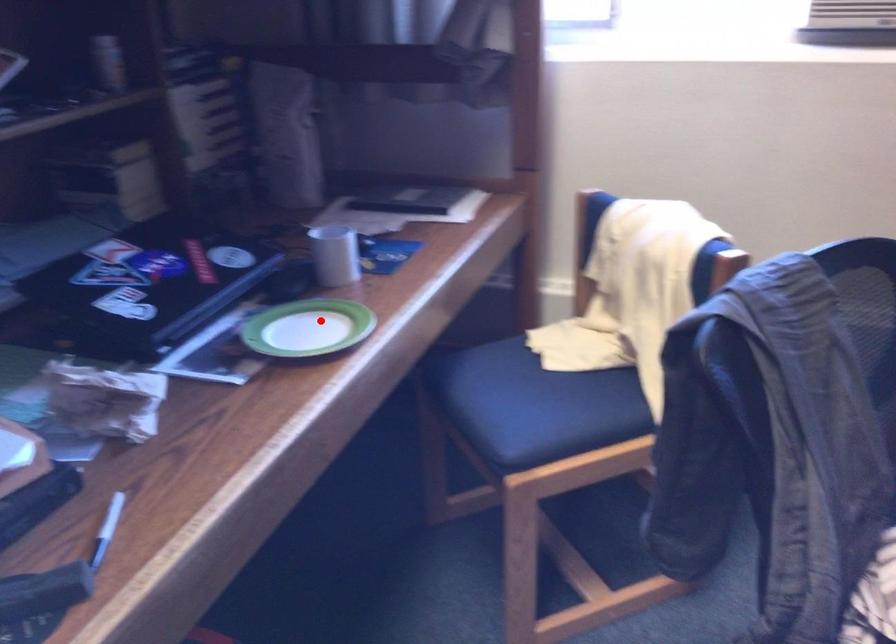
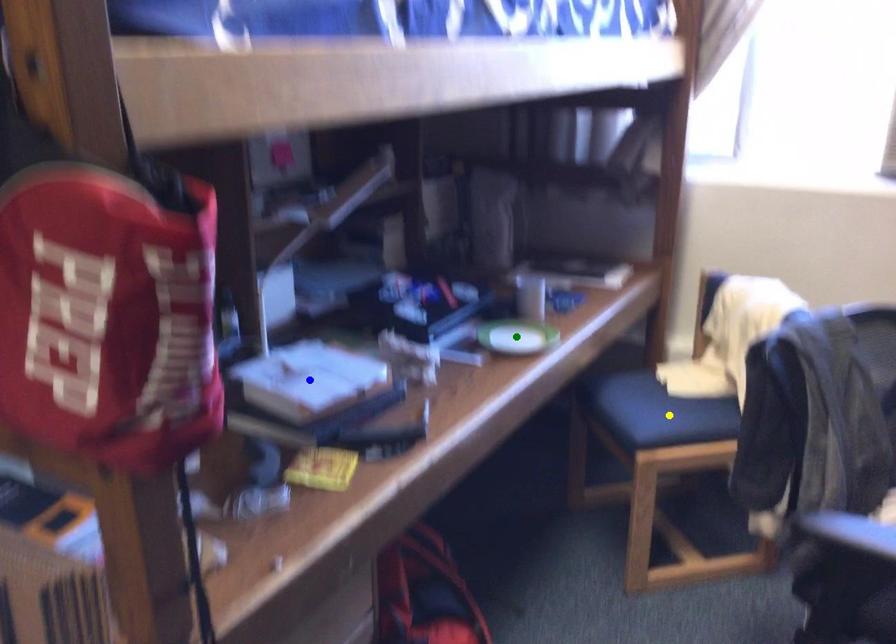
Question: I am providing you with two images of the same scene from different viewpoints. A red point is marked on the first image. You are given multiple points on the second image. Which spot in image 2 lines up with the point in image 1?

Choices:
 (A) green point
 (B) yellow point
 (C) blue point

Answer: (A)